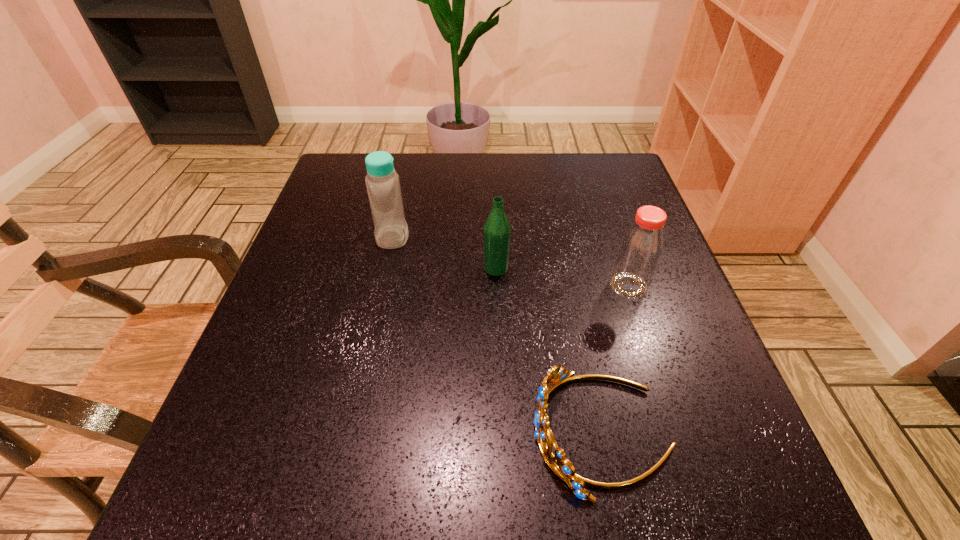
Locate an element on the screen. This screenshot has height=540, width=960. the farthest object is located at coordinates (391, 231).

Where is `the farthest bottle`? The height and width of the screenshot is (540, 960). the farthest bottle is located at coordinates (391, 231).

In order to click on the rightmost bottle in this screenshot , I will do `click(641, 246)`.

The width and height of the screenshot is (960, 540). I want to click on the third object from right to left, so click(497, 232).

Where is `tiara`? tiara is located at coordinates (560, 465).

The height and width of the screenshot is (540, 960). Identify the location of the shortest object. (560, 465).

Identify the location of vacant space situated on the back of the farthest object. click(x=402, y=192).

Where is `vacant space located on the left of the rightmost bottle`? This screenshot has width=960, height=540. vacant space located on the left of the rightmost bottle is located at coordinates (480, 286).

Where is `vacant space located on the back of the second bottle from right to left`? This screenshot has height=540, width=960. vacant space located on the back of the second bottle from right to left is located at coordinates (492, 184).

You are a GUI agent. You are given a task and a screenshot of the screen. Output one action in this format:
    pyautogui.click(x=<x>, y=<y>)
    Task: Click on the free space located 0.170m on the front-facing side of the tiara
    Image resolution: width=960 pixels, height=540 pixels.
    Given the screenshot: What is the action you would take?
    pyautogui.click(x=420, y=433)